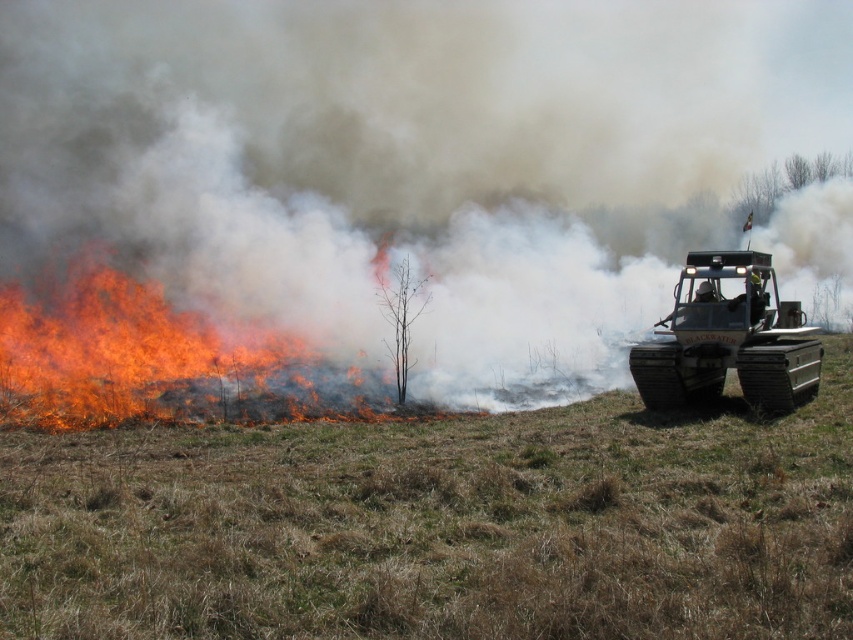
Can you confirm if brown dry grass at lower center is positioned to the right of matte black tracked vehicle at right?

In fact, brown dry grass at lower center is to the left of matte black tracked vehicle at right.

How far apart are brown dry grass at lower center and matte black tracked vehicle at right?

They are 4.25 meters apart.

Is point (151, 624) positioned after point (741, 339)?

No, it is in front of (741, 339).

The height and width of the screenshot is (640, 853). What are the coordinates of `brown dry grass at lower center` in the screenshot? It's located at (440, 525).

Who is positioned more to the right, white smoke at center or brown dry grass at lower center?

From the viewer's perspective, white smoke at center appears more on the right side.

Does point (68, 61) lie behind point (440, 536)?

Yes, point (68, 61) is behind point (440, 536).

What do you see at coordinates (410, 156) in the screenshot? I see `white smoke at center` at bounding box center [410, 156].

The height and width of the screenshot is (640, 853). Find the location of `white smoke at center`. white smoke at center is located at coordinates (410, 156).

Is point (67, 4) farther from camera compared to point (344, 397)?

Yes, point (67, 4) is behind point (344, 397).

Who is taller, white smoke at center or flame-yellows grass fire at left?

With more height is white smoke at center.

Identify the location of white smoke at center. This screenshot has width=853, height=640. (410, 156).

You are a GUI agent. You are given a task and a screenshot of the screen. Output one action in this format:
    pyautogui.click(x=<x>, y=<y>)
    Task: Click on the white smoke at center
    This screenshot has width=853, height=640.
    Given the screenshot: What is the action you would take?
    pyautogui.click(x=410, y=156)